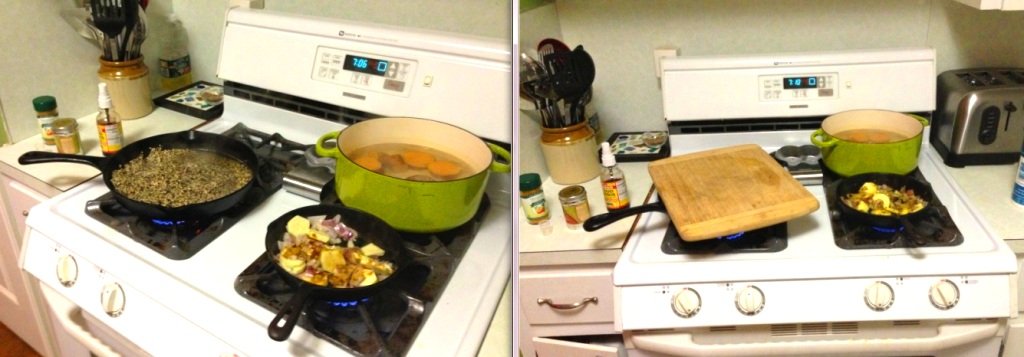
The height and width of the screenshot is (357, 1024). I want to click on knobs, so click(x=60, y=273), click(x=108, y=297), click(x=685, y=299), click(x=753, y=301), click(x=877, y=292), click(x=944, y=292).